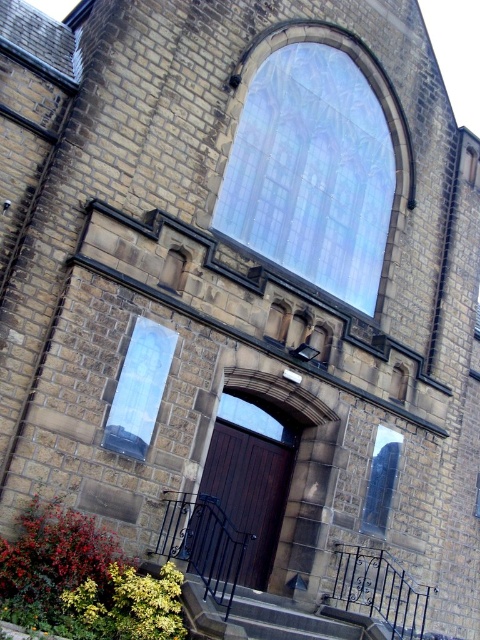
Can you confirm if clear glass window at center is thinner than transparent glass window at center?

No, clear glass window at center is not thinner than transparent glass window at center.

Which is below, clear glass window at center or transparent glass window at center?

→ transparent glass window at center

Does point (136, 374) come farther from viewer compared to point (379, 490)?

No, (136, 374) is closer to viewer.

This screenshot has height=640, width=480. What are the coordinates of `clear glass window at center` in the screenshot? It's located at (140, 388).

Where is `stained glass window at upper center`? The image size is (480, 640). stained glass window at upper center is located at coordinates (313, 170).

Based on the photo, who is more forward, (249, 96) or (254, 548)?

Point (254, 548) is more forward.

Where is `stained glass window at upper center`? The image size is (480, 640). stained glass window at upper center is located at coordinates (313, 170).

Can you confirm if dark wood door at center is shorter than transparent glass window at center?

No.

Is dark wood door at center below transparent glass window at center?

Yes.

In the scene shown: Who is more distant from viewer, (230,502) or (377,449)?

Point (377,449)

At what (x,y) coordinates should I click in order to perform the action: click on dark wood door at center. Please return your answer as a coordinate pair (x, y). The height and width of the screenshot is (640, 480). Looking at the image, I should click on (249, 492).